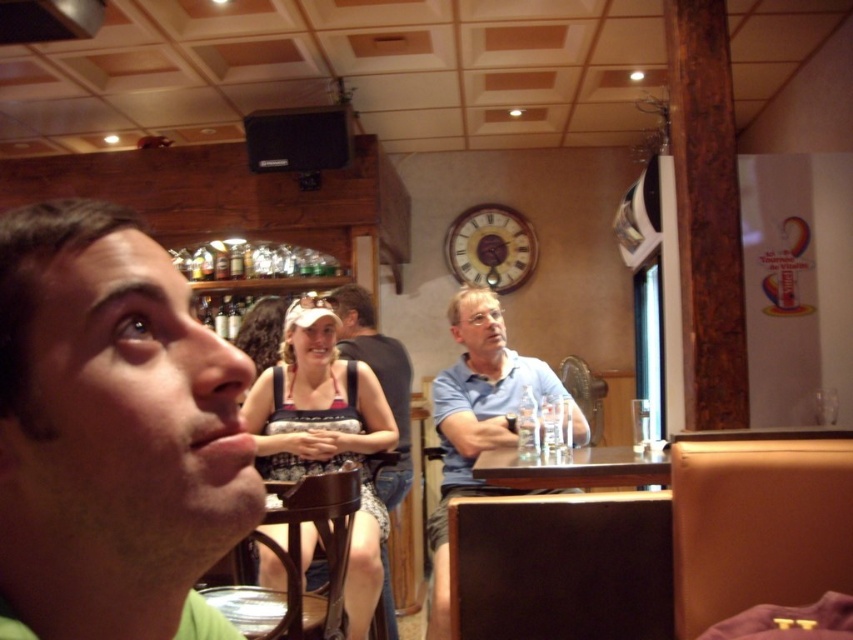
Consider the image. Can you confirm if patterned fabric tank top at center is positioned to the left of blue cotton shirt at center?

Correct, you'll find patterned fabric tank top at center to the left of blue cotton shirt at center.

Does patterned fabric tank top at center have a greater width compared to blue cotton shirt at center?

No.

Is point (286, 378) less distant than point (450, 301)?

That is True.

I want to click on patterned fabric tank top at center, so click(x=325, y=435).

Does green matte shirt at left appear under brown wooden table at center?

No.

Can you confirm if green matte shirt at left is positioned to the right of brown wooden table at center?

No, green matte shirt at left is not to the right of brown wooden table at center.

Is point (73, 323) positioned in front of point (531, 464)?

Yes, it is in front of point (531, 464).

You are a GUI agent. You are given a task and a screenshot of the screen. Output one action in this format:
    pyautogui.click(x=<x>, y=<y>)
    Task: Click on the green matte shirt at left
    
    Given the screenshot: What is the action you would take?
    pyautogui.click(x=111, y=433)

Is green matte shirt at left to the left of patterned fabric tank top at center from the viewer's perspective?

Incorrect, green matte shirt at left is not on the left side of patterned fabric tank top at center.

Is green matte shirt at left positioned behind patterned fabric tank top at center?

No.

Is point (144, 564) closer to camera compared to point (367, 445)?

Yes, it is in front of point (367, 445).

This screenshot has width=853, height=640. What are the coordinates of `green matte shirt at left` in the screenshot? It's located at (111, 433).